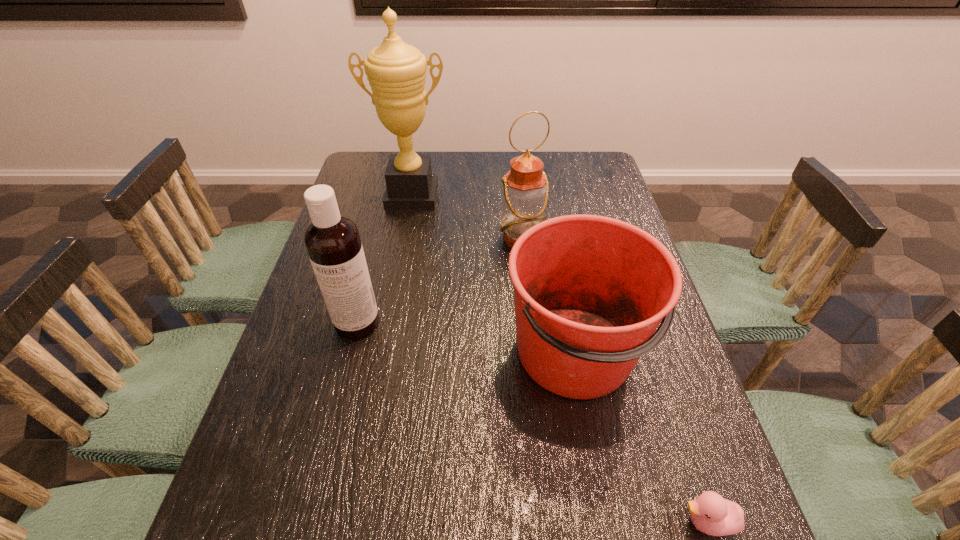
You are a GUI agent. You are given a task and a screenshot of the screen. Output one action in this format:
    pyautogui.click(x=<x>, y=<y>)
    Task: Click on the free space between the second shortest object and the farthest object
    
    Given the screenshot: What is the action you would take?
    pyautogui.click(x=494, y=274)

You are a GUI agent. You are given a task and a screenshot of the screen. Output one action in this format:
    pyautogui.click(x=<x>, y=<y>)
    Task: Click on the vacant point located between the tallest object and the fourth nearest object
    The image size is (960, 540).
    Given the screenshot: What is the action you would take?
    pyautogui.click(x=467, y=218)

You are a GUI agent. You are given a task and a screenshot of the screen. Output one action in this format:
    pyautogui.click(x=<x>, y=<y>)
    Task: Click on the vacant space that is in between the dishwasher detergent and the tallest object
    The image size is (960, 540).
    Given the screenshot: What is the action you would take?
    pyautogui.click(x=385, y=260)

Where is `free area in between the tallest object and the dishwasher detergent`? This screenshot has width=960, height=540. free area in between the tallest object and the dishwasher detergent is located at coordinates click(x=385, y=260).

Find the location of a particular element. free space between the second shortest object and the dishwasher detergent is located at coordinates (467, 338).

Find the location of a particular element. The image size is (960, 540). the fourth closest object to the farthest object is located at coordinates (712, 514).

Choose which object is the fourth nearest neighbor to the tallest object. Please provide its 2D coordinates. Your answer should be formatted as a tuple, i.e. [(x, y)], where the tuple contains the x and y coordinates of a point satisfying the conditions above.

[(712, 514)]

Identify the location of vacant space that satisfies the following two spatial constraints: 1. at the front of the trophy cup with handles; 2. on the left side of the oil lamp. This screenshot has width=960, height=540. pyautogui.click(x=404, y=239).

You are a GUI agent. You are given a task and a screenshot of the screen. Output one action in this format:
    pyautogui.click(x=<x>, y=<y>)
    Task: Click on the free space that satisfies the following two spatial constraints: 1. at the front of the farthest object with handles; 2. on the left side of the oil lamp
    The height and width of the screenshot is (540, 960).
    Given the screenshot: What is the action you would take?
    pyautogui.click(x=404, y=239)

Identify the location of free location that satisfies the following two spatial constraints: 1. at the front of the second shortest object with handles; 2. on the right side of the trophy cup. (383, 352).